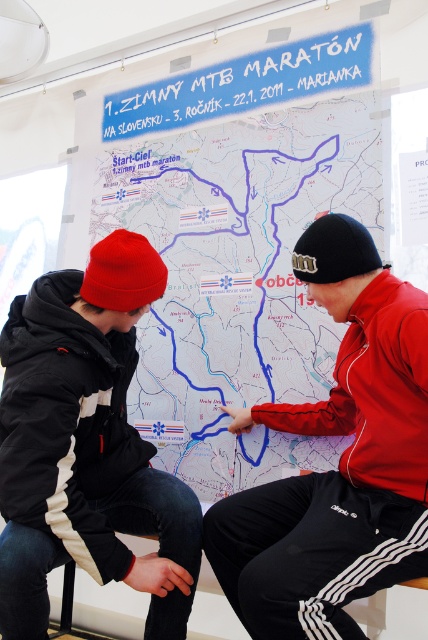
Who is lower down, red fleece jacket at center or black matte jacket at left?

black matte jacket at left is lower down.

Does red fleece jacket at center have a larger size compared to black matte jacket at left?

Indeed, red fleece jacket at center has a larger size compared to black matte jacket at left.

Is point (259, 616) farther from viewer compared to point (41, 624)?

No, (259, 616) is in front of (41, 624).

Identify the location of red fleece jacket at center. (338, 460).

Is point (168, 458) closer to viewer compared to point (306, 492)?

No, it is not.

In the scene shown: Is matte paper map at center shorter than red fleece jacket at center?

No, matte paper map at center is not shorter than red fleece jacket at center.

Locate an element on the screen. The width and height of the screenshot is (428, 640). matte paper map at center is located at coordinates (237, 276).

You are a GUI agent. You are given a task and a screenshot of the screen. Output one action in this format:
    pyautogui.click(x=<x>, y=<y>)
    Task: Click on the matte paper map at center
    The height and width of the screenshot is (640, 428).
    Given the screenshot: What is the action you would take?
    pyautogui.click(x=237, y=276)

The image size is (428, 640). Describe the element at coordinates (237, 276) in the screenshot. I see `matte paper map at center` at that location.

Does matte paper map at center have a greater width compared to black matte jacket at left?

Correct, the width of matte paper map at center exceeds that of black matte jacket at left.

Locate an element on the screen. The image size is (428, 640). matte paper map at center is located at coordinates (237, 276).